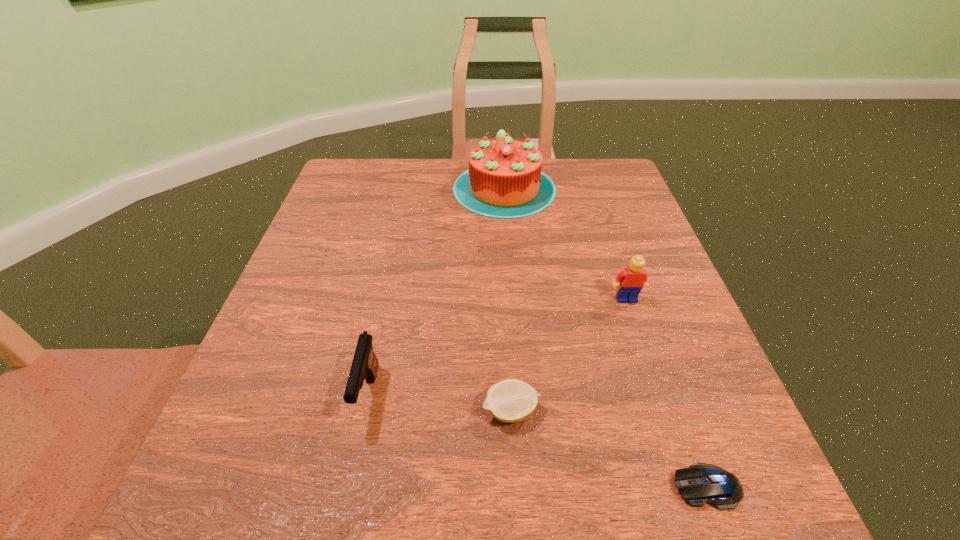
The height and width of the screenshot is (540, 960). I want to click on vacant region at the near edge of the desktop, so click(555, 502).

This screenshot has height=540, width=960. I want to click on vacant space at the left edge of the desktop, so click(x=299, y=318).

Locate an element on the screen. The image size is (960, 540). vacant space at the right edge is located at coordinates (636, 313).

In the image, there is a desktop. At what (x,y) coordinates should I click in order to perform the action: click on free space at the far left corner. Please return your answer as a coordinate pair (x, y). The image size is (960, 540). Looking at the image, I should click on (368, 163).

In order to click on vacant space at the near left corner of the desktop in this screenshot , I will do 306,500.

Image resolution: width=960 pixels, height=540 pixels. I want to click on unoccupied position between the farthest object and the nearest object, so click(606, 338).

At what (x,y) coordinates should I click in order to perform the action: click on free space between the lemon and the pistol. Please return your answer as a coordinate pair (x, y). The image size is (960, 540). Looking at the image, I should click on (440, 403).

Identify the location of empty space that is in between the leftmost object and the lemon. This screenshot has height=540, width=960. (440, 403).

The width and height of the screenshot is (960, 540). Identify the location of free space between the fourth nearest object and the cake. (565, 244).

Where is `empty location between the shortest object and the pistol`? The height and width of the screenshot is (540, 960). empty location between the shortest object and the pistol is located at coordinates click(538, 441).